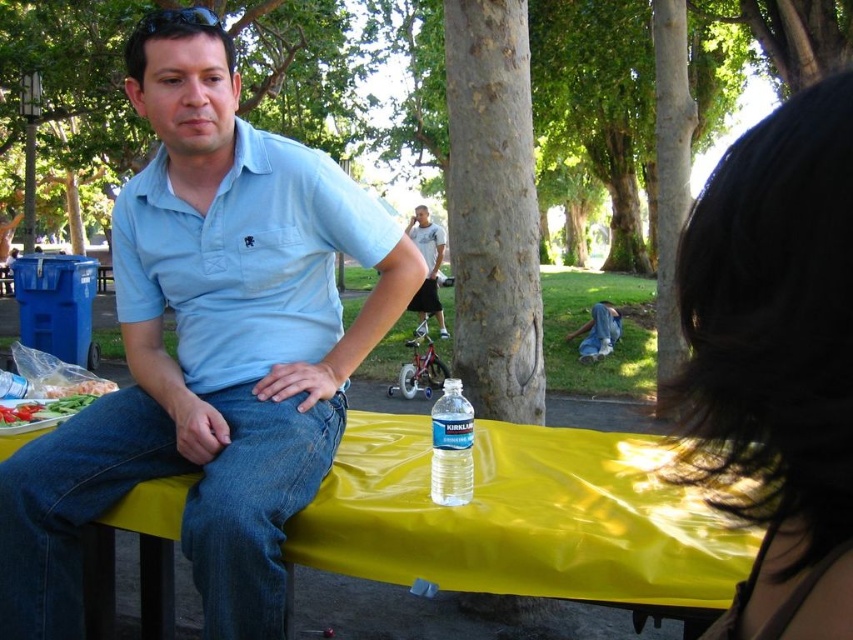
Question: Is yellow plastic picnic table at center closer to camera compared to green matte vegetables at lower left?

Choices:
 (A) no
 (B) yes

Answer: (B)

Question: Which point appears farthest from the camera in this image?

Choices:
 (A) (828, 154)
 (B) (433, 276)
 (C) (28, 499)

Answer: (B)

Question: Which object is positioned farthest from the clear plastic water bottle at center?

Choices:
 (A) denim pants at lower right
 (B) denim jeans at lower left
 (C) light blue cotton polo shirt at center
 (D) light blue shirt at center

Answer: (D)

Question: Is clear plastic water bottle at center to the right of green matte vegetables at lower left from the viewer's perspective?

Choices:
 (A) no
 (B) yes

Answer: (B)

Question: Does light blue cotton shirt at center lie behind light blue cotton polo shirt at center?

Choices:
 (A) yes
 (B) no

Answer: (B)

Question: Considering the real-world distances, which object is closest to the dark brown hair at upper right?

Choices:
 (A) clear plastic water bottle at center
 (B) light blue shirt at center
 (C) light blue cotton shirt at center
 (D) denim pants at lower right

Answer: (A)